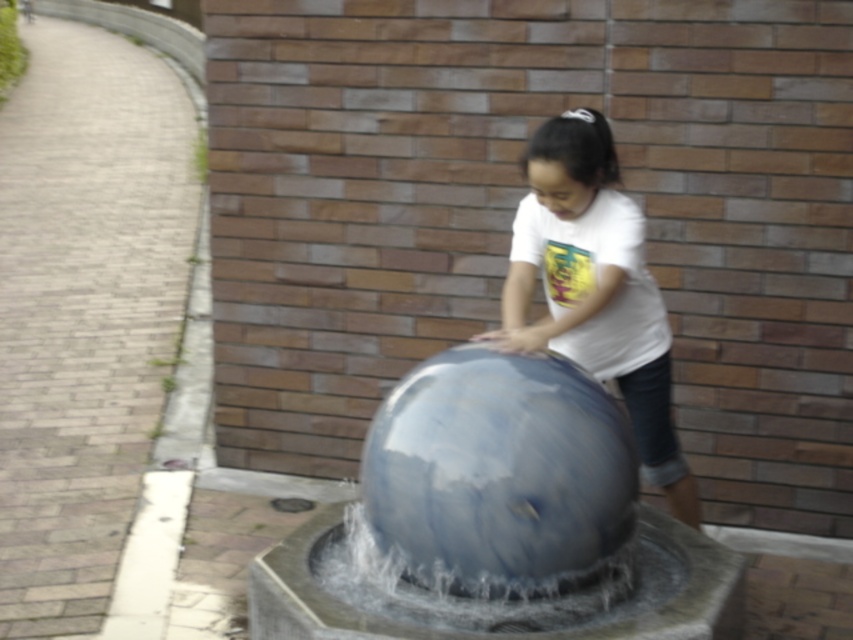
Looking at this image, based on the coordinates provided, where is the transparent glass water at center located in the image?

The transparent glass water at center is located at the coordinates point (498,474).

You are a photographer trying to capture the reflection of the brick wall in the shiny metallic sphere at center. Since the sphere is taller than the transparent glass water at center, will the reflection of the brick wall be larger or smaller in the sphere compared to the water?

The shiny metallic sphere at center is taller than the transparent glass water at center. Since the sphere is taller, it can capture a larger portion of the brick wall in its reflection, making the reflection larger than that in the water.